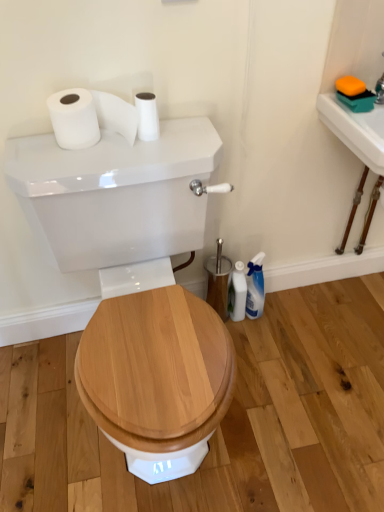
This screenshot has width=384, height=512. I want to click on spots to the right of white glossy toilet brush at lower right, so click(x=284, y=323).